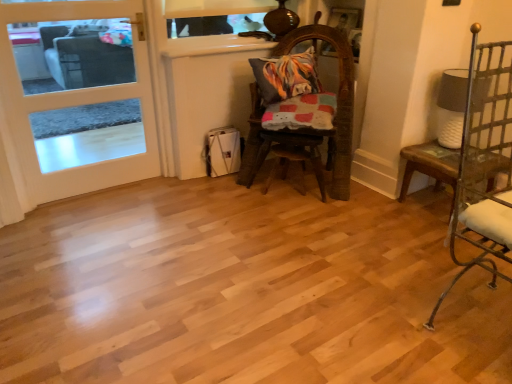
Question: Does white wood door at left have a greater width compared to worn wood chair at center, which is the second chair from right to left?

Choices:
 (A) yes
 (B) no

Answer: (B)

Question: Is white wood door at left placed right next to worn wood chair at center, marked as the 1th chair in a back-to-front arrangement?

Choices:
 (A) yes
 (B) no

Answer: (B)

Question: Is white wood door at left positioned behind worn wood chair at center, which is the second chair from right to left?

Choices:
 (A) yes
 (B) no

Answer: (A)

Question: Would you say worn wood chair at center, arranged as the first chair when viewed from the left, is part of white wood door at left's contents?

Choices:
 (A) no
 (B) yes

Answer: (A)

Question: Is white wood door at left not within worn wood chair at center, which is the second chair from right to left?

Choices:
 (A) no
 (B) yes

Answer: (B)

Question: Considering the positions of worn wood chair at center, the second chair in the front-to-back sequence, and white wood door at left in the image, is worn wood chair at center, the second chair in the front-to-back sequence, taller or shorter than white wood door at left?

Choices:
 (A) short
 (B) tall

Answer: (A)

Question: Is worn wood chair at center, which is the second chair from right to left, to the left or to the right of white wood door at left in the image?

Choices:
 (A) left
 (B) right

Answer: (B)

Question: Considering the positions of point (318, 134) and point (82, 23), is point (318, 134) closer or farther from the camera than point (82, 23)?

Choices:
 (A) farther
 (B) closer

Answer: (A)

Question: From a real-world perspective, is worn wood chair at center, marked as the 1th chair in a back-to-front arrangement, physically located above or below white wood door at left?

Choices:
 (A) below
 (B) above

Answer: (A)

Question: Based on their sizes in the image, would you say white ceramic table at right is bigger or smaller than worn wood chair at center, arranged as the first chair when viewed from the left?

Choices:
 (A) big
 (B) small

Answer: (B)

Question: From a real-world perspective, is white ceramic table at right above or below worn wood chair at center, the second chair in the front-to-back sequence?

Choices:
 (A) below
 (B) above

Answer: (A)

Question: Visually, is white ceramic table at right positioned to the left or to the right of worn wood chair at center, arranged as the first chair when viewed from the left?

Choices:
 (A) left
 (B) right

Answer: (B)

Question: In terms of width, does white ceramic table at right look wider or thinner when compared to worn wood chair at center, marked as the 1th chair in a back-to-front arrangement?

Choices:
 (A) thin
 (B) wide

Answer: (A)

Question: Relative to white ceramic table at right, is white textured lampshade at right in front or behind?

Choices:
 (A) front
 (B) behind

Answer: (B)

Question: Considering the relative positions of white textured lampshade at right and white ceramic table at right in the image provided, is white textured lampshade at right to the left or to the right of white ceramic table at right?

Choices:
 (A) left
 (B) right

Answer: (B)